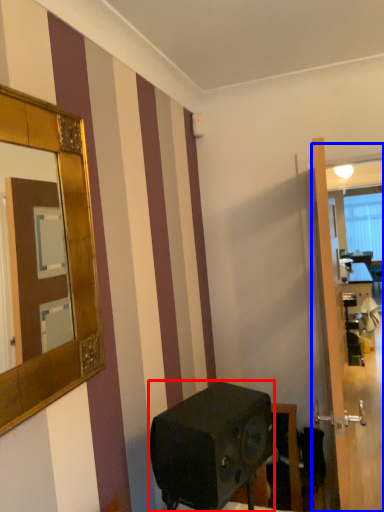
Question: Among these objects, which one is nearest to the camera, appliance (highlighted by a red box) or glass door (highlighted by a blue box)?

Choices:
 (A) appliance
 (B) glass door

Answer: (A)